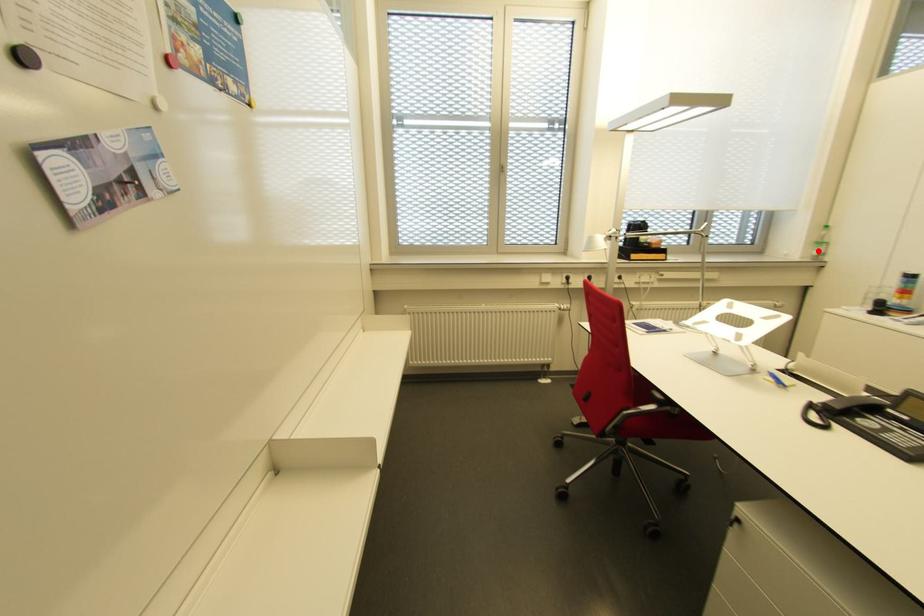
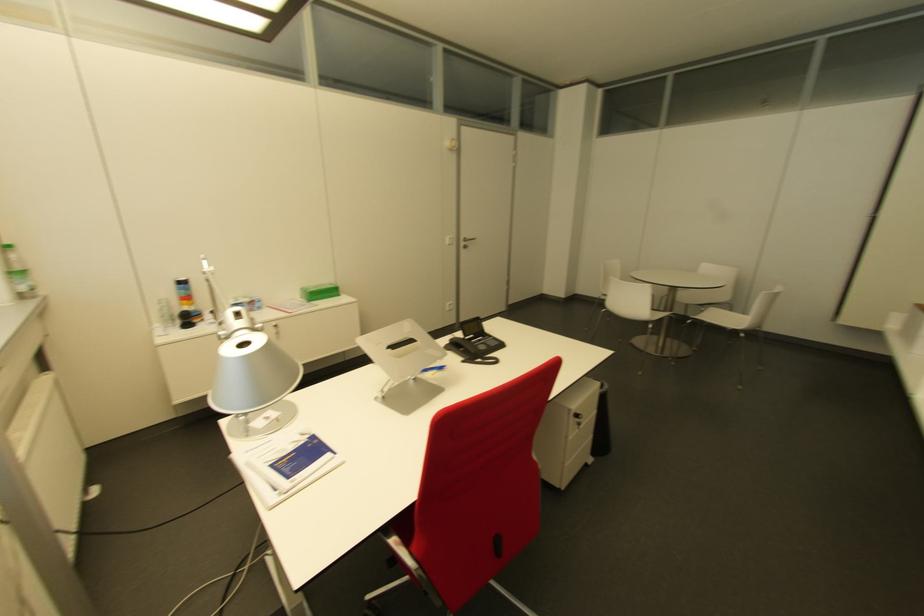
Question: I am providing you with two images of the same scene from different viewpoints. In image1, a red point is highlighted. Considering the same 3D point in image2, which of the following is correct?

Choices:
 (A) It is closer
 (B) It is farther

Answer: (B)